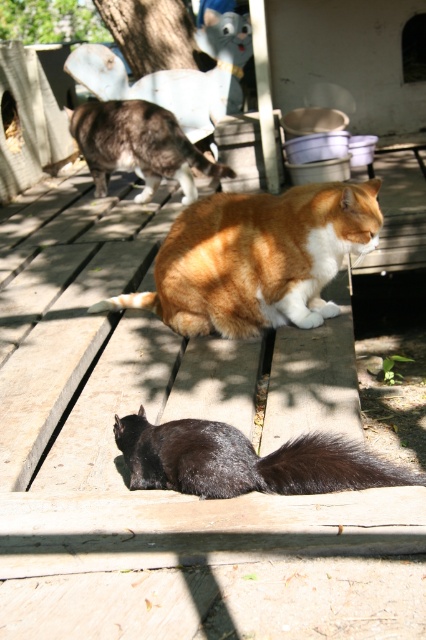
Question: Which point is farther to the camera?

Choices:
 (A) (147, 304)
 (B) (123, 120)

Answer: (B)

Question: Is shiny black cat at lower center wider than gray-furred cat at upper left?

Choices:
 (A) yes
 (B) no

Answer: (B)

Question: Does gray-furred cat at upper left appear on the left side of brown fur tail at lower center?

Choices:
 (A) yes
 (B) no

Answer: (A)

Question: Is orange fur cat at center below brown fur tail at lower center?

Choices:
 (A) no
 (B) yes

Answer: (A)

Question: Considering the real-world distances, which object is closest to the brown fur tail at lower center?

Choices:
 (A) orange fur cat at center
 (B) gray-furred cat at upper left
 (C) black silky tail at lower center

Answer: (A)

Question: Which object is the farthest from the orange fur cat at center?

Choices:
 (A) shiny black cat at lower center
 (B) black silky tail at lower center

Answer: (B)